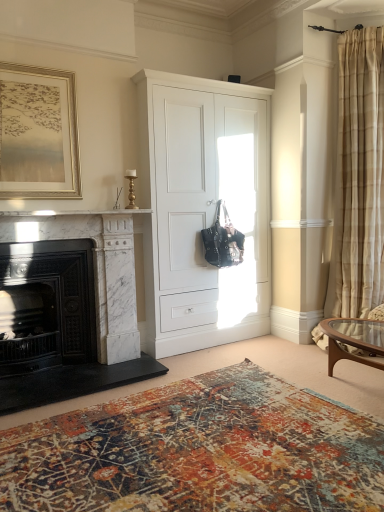
Question: Does black marble fireplace at left, arranged as the 2th fireplace when viewed from the right, come behind gold metallic picture frame at upper left?

Choices:
 (A) no
 (B) yes

Answer: (A)

Question: Can you confirm if black marble fireplace at left, the 1th fireplace viewed from the left, is shorter than gold metallic picture frame at upper left?

Choices:
 (A) yes
 (B) no

Answer: (B)

Question: Is black marble fireplace at left, the 1th fireplace viewed from the left, bigger than gold metallic picture frame at upper left?

Choices:
 (A) no
 (B) yes

Answer: (B)

Question: From a real-world perspective, is black marble fireplace at left, the 1th fireplace viewed from the left, physically below gold metallic picture frame at upper left?

Choices:
 (A) yes
 (B) no

Answer: (A)

Question: Does black marble fireplace at left, arranged as the 2th fireplace when viewed from the right, have a smaller size compared to gold metallic picture frame at upper left?

Choices:
 (A) yes
 (B) no

Answer: (B)

Question: Considering the relative positions of black marble fireplace at left, arranged as the 2th fireplace when viewed from the right, and gold metallic picture frame at upper left in the image provided, is black marble fireplace at left, arranged as the 2th fireplace when viewed from the right, to the left of gold metallic picture frame at upper left from the viewer's perspective?

Choices:
 (A) yes
 (B) no

Answer: (A)

Question: Is white marble fireplace at left not inside white marble fireplace at left, the 1th fireplace viewed from the right?

Choices:
 (A) no
 (B) yes

Answer: (B)

Question: From the image's perspective, would you say white marble fireplace at left is shown under white marble fireplace at left, arranged as the second fireplace when viewed from the left?

Choices:
 (A) yes
 (B) no

Answer: (B)

Question: Is white marble fireplace at left wider than white marble fireplace at left, arranged as the second fireplace when viewed from the left?

Choices:
 (A) no
 (B) yes

Answer: (A)

Question: Is white marble fireplace at left to the right of white marble fireplace at left, arranged as the second fireplace when viewed from the left, from the viewer's perspective?

Choices:
 (A) yes
 (B) no

Answer: (A)

Question: Can you confirm if white marble fireplace at left is positioned to the left of white marble fireplace at left, arranged as the second fireplace when viewed from the left?

Choices:
 (A) yes
 (B) no

Answer: (B)

Question: Considering the relative sizes of white marble fireplace at left and white marble fireplace at left, the 1th fireplace viewed from the right, in the image provided, is white marble fireplace at left taller than white marble fireplace at left, the 1th fireplace viewed from the right,?

Choices:
 (A) no
 (B) yes

Answer: (A)

Question: From the image's perspective, is white marble fireplace at left located above gold metallic picture frame at upper left?

Choices:
 (A) no
 (B) yes

Answer: (A)